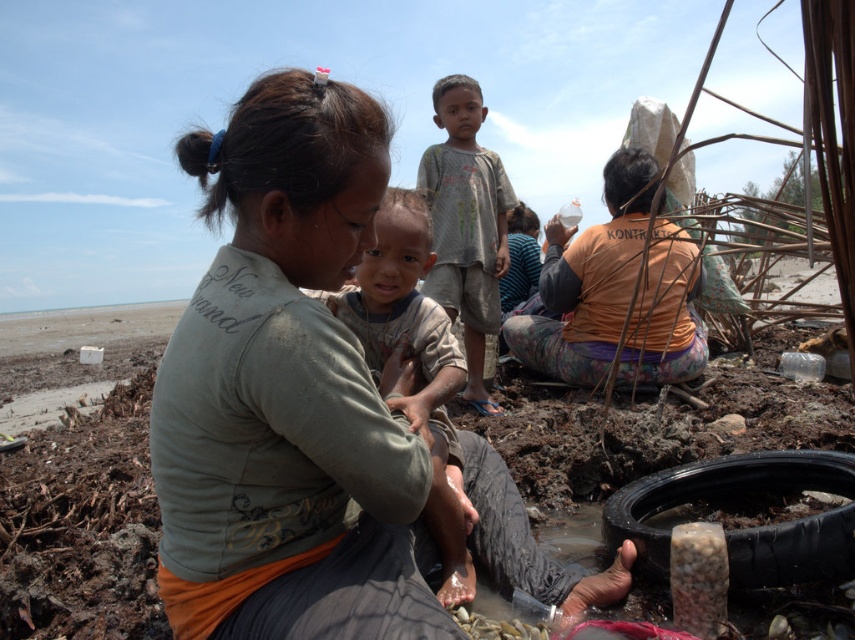
You are a photographer setting up a shot at the beach scene. You want to ensure both the orange fabric at center and the gray cotton shirt at center are visible in the frame. Which object should you position closer to the camera to achieve this?

The orange fabric at center is in front of the gray cotton shirt at center, so positioning the orange fabric at center closer to the camera will ensure both are visible.

You are a photographer trying to capture a photo of the matte green shirt at center and the gray cotton shirt at center. Which one should you focus on first if you want to include both in your shot without moving the camera?

The matte green shirt at center is positioned on the left side of gray cotton shirt at center, so you should focus on the matte green shirt at center first to ensure both are in frame.

You are standing at the origin point of the image. Where is the orange fabric at center located in terms of coordinates?

The orange fabric at center is located at coordinates point [615,292].